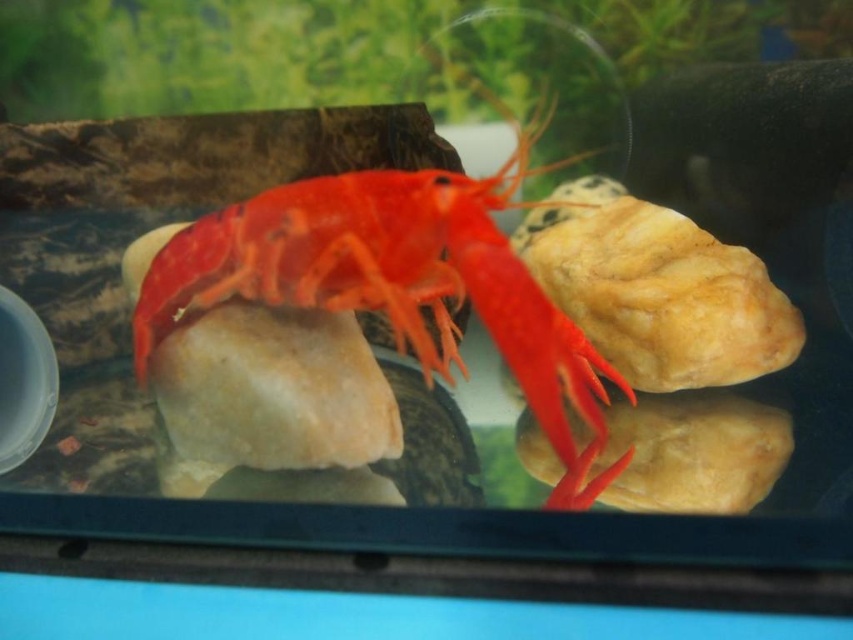
Question: Which of the following is the farthest from the observer?

Choices:
 (A) (426, 250)
 (B) (740, 477)

Answer: (B)

Question: Is shiny orange lobster at center above smooth beige rock at center?

Choices:
 (A) yes
 (B) no

Answer: (A)

Question: Is shiny orange lobster at center above smooth beige rock at center?

Choices:
 (A) no
 (B) yes

Answer: (B)

Question: Which object appears closest to the camera in this image?

Choices:
 (A) shiny orange lobster at center
 (B) smooth beige rock at center

Answer: (A)

Question: Is shiny orange lobster at center above smooth beige rock at center?

Choices:
 (A) no
 (B) yes

Answer: (B)